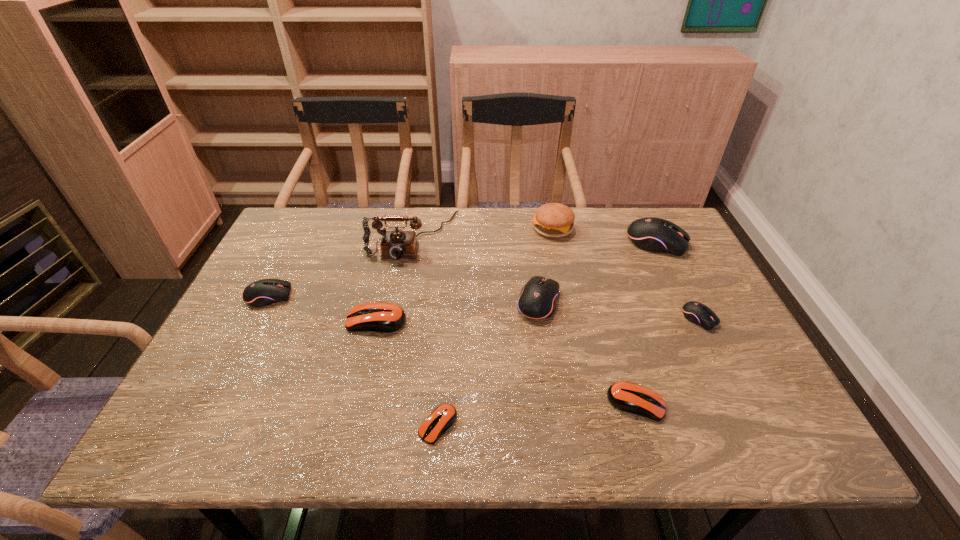
Identify the location of free region located 0.210m on the back of the leftmost orange computer mouse. This screenshot has height=540, width=960. (392, 258).

Locate an element on the screen. free space located on the left of the smallest black computer mouse is located at coordinates (557, 319).

Identify the location of blank space located on the left of the third computer mouse from right to left. The height and width of the screenshot is (540, 960). (537, 403).

This screenshot has height=540, width=960. Find the location of `vacant region located 0.340m on the left of the shortest object`. vacant region located 0.340m on the left of the shortest object is located at coordinates (251, 426).

In order to click on telephone located at the far edge in this screenshot , I will do `click(397, 244)`.

Locate an element on the screen. The image size is (960, 540). hamburger located at the far edge is located at coordinates (555, 220).

What are the coordinates of `computer mouse that is at the far edge` in the screenshot? It's located at (651, 234).

This screenshot has width=960, height=540. What are the coordinates of `object located in the left edge section of the desktop` in the screenshot? It's located at (261, 293).

The height and width of the screenshot is (540, 960). I want to click on object present at the far right corner, so click(x=651, y=234).

You are a GUI agent. You are given a task and a screenshot of the screen. Output one action in this format:
    pyautogui.click(x=<x>, y=<y>)
    Task: Click on the vacant space at the far edge of the desktop
    The height and width of the screenshot is (540, 960).
    Given the screenshot: What is the action you would take?
    [520, 222]